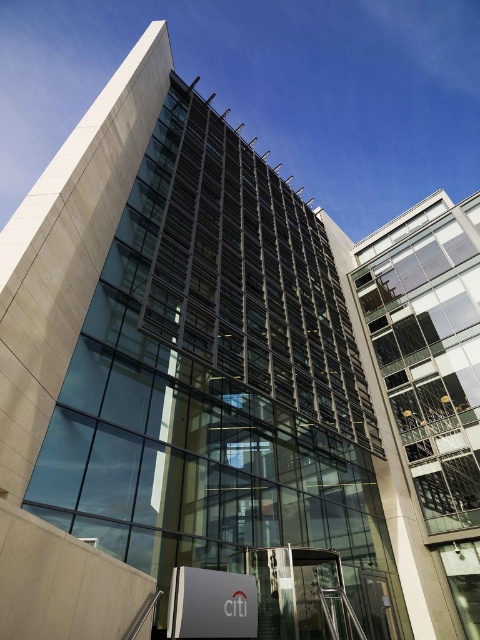
Question: Can you confirm if clear glass building at right is thinner than metallic staircase at lower center?

Choices:
 (A) yes
 (B) no

Answer: (B)

Question: Is clear glass building at right below metallic staircase at lower center?

Choices:
 (A) yes
 (B) no

Answer: (B)

Question: Does clear glass building at right have a smaller size compared to metallic staircase at lower center?

Choices:
 (A) no
 (B) yes

Answer: (A)

Question: Which point is closer to the camera?

Choices:
 (A) (416, 452)
 (B) (260, 621)

Answer: (B)